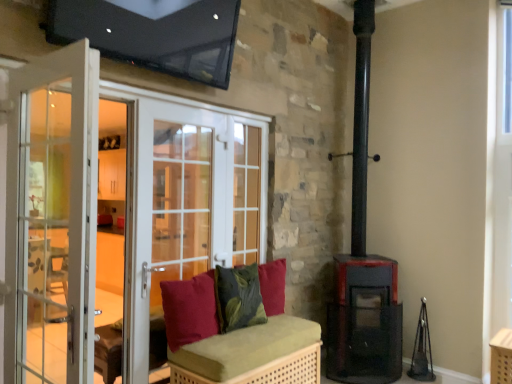
Question: Is white glass screen door at left, the first screen door in the front-to-back sequence, in front of velvet red cushion at center, which ranks as the 3th pillow in back-to-front order?

Choices:
 (A) no
 (B) yes

Answer: (B)

Question: Considering the relative sizes of white glass screen door at left, which is counted as the 2th screen door, starting from the back, and velvet red cushion at center, which ranks as the 3th pillow in back-to-front order, in the image provided, is white glass screen door at left, which is counted as the 2th screen door, starting from the back, taller than velvet red cushion at center, which ranks as the 3th pillow in back-to-front order,?

Choices:
 (A) yes
 (B) no

Answer: (A)

Question: Does white glass screen door at left, which is counted as the 2th screen door, starting from the back, appear on the left side of velvet red cushion at center, which ranks as the 3th pillow in back-to-front order?

Choices:
 (A) no
 (B) yes

Answer: (B)

Question: Does white glass screen door at left, the first screen door in the front-to-back sequence, appear on the right side of velvet red cushion at center, which ranks as the 3th pillow in back-to-front order?

Choices:
 (A) yes
 (B) no

Answer: (B)

Question: Is white glass screen door at left, which is counted as the 2th screen door, starting from the back, positioned far away from velvet red cushion at center, which ranks as the 3th pillow in back-to-front order?

Choices:
 (A) yes
 (B) no

Answer: (A)

Question: Is white glass screen door at left, which is counted as the 2th screen door, starting from the back, positioned with its back to velvet red cushion at center, which ranks as the 3th pillow in back-to-front order?

Choices:
 (A) no
 (B) yes

Answer: (A)

Question: From a real-world perspective, is velvet red cushion at center, which ranks as the 3th pillow in back-to-front order, positioned under white glass screen door at left, which is counted as the 2th screen door, starting from the back, based on gravity?

Choices:
 (A) no
 (B) yes

Answer: (B)

Question: Is velvet red cushion at center, the first pillow positioned from the front, to the left of white glass screen door at left, which is counted as the 2th screen door, starting from the back, from the viewer's perspective?

Choices:
 (A) no
 (B) yes

Answer: (A)

Question: Is velvet red cushion at center, which ranks as the 3th pillow in back-to-front order, thinner than white glass screen door at left, the first screen door in the front-to-back sequence?

Choices:
 (A) yes
 (B) no

Answer: (B)

Question: Is the position of velvet red cushion at center, which ranks as the 3th pillow in back-to-front order, less distant than that of white glass screen door at left, the first screen door in the front-to-back sequence?

Choices:
 (A) yes
 (B) no

Answer: (B)

Question: Can you confirm if velvet red cushion at center, which ranks as the 3th pillow in back-to-front order, is wider than white glass screen door at left, the first screen door in the front-to-back sequence?

Choices:
 (A) yes
 (B) no

Answer: (A)

Question: Is velvet red cushion at center, the first pillow positioned from the front, positioned beyond the bounds of white glass screen door at left, which is counted as the 2th screen door, starting from the back?

Choices:
 (A) no
 (B) yes

Answer: (B)

Question: Can you confirm if matte black stove at lower right is taller than velvet red cushion at center, positioned as the third pillow in front-to-back order?

Choices:
 (A) no
 (B) yes

Answer: (B)